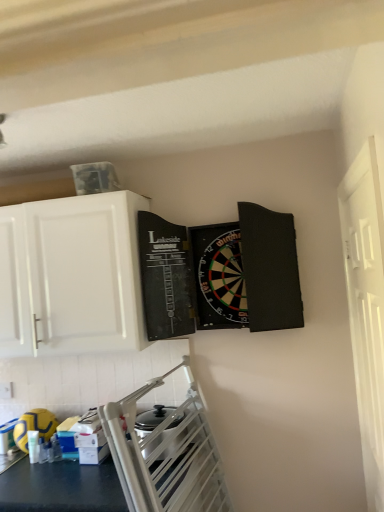
Question: Does yellow rubber ball at lower left appear on the left side of white wooden door at right?

Choices:
 (A) no
 (B) yes

Answer: (B)

Question: Can you confirm if yellow rubber ball at lower left is smaller than white wooden door at right?

Choices:
 (A) no
 (B) yes

Answer: (B)

Question: Are yellow rubber ball at lower left and white wooden door at right making contact?

Choices:
 (A) yes
 (B) no

Answer: (B)

Question: Is yellow rubber ball at lower left surrounding white wooden door at right?

Choices:
 (A) no
 (B) yes

Answer: (A)

Question: Can you confirm if yellow rubber ball at lower left is thinner than white wooden door at right?

Choices:
 (A) yes
 (B) no

Answer: (B)

Question: From a real-world perspective, does yellow rubber ball at lower left stand above white wooden door at right?

Choices:
 (A) no
 (B) yes

Answer: (A)

Question: From the image's perspective, does white glossy cabinet at upper left appear lower than white wooden door at right?

Choices:
 (A) no
 (B) yes

Answer: (A)

Question: Are white glossy cabinet at upper left and white wooden door at right far apart?

Choices:
 (A) no
 (B) yes

Answer: (B)

Question: Does white glossy cabinet at upper left have a smaller size compared to white wooden door at right?

Choices:
 (A) yes
 (B) no

Answer: (B)

Question: From the image's perspective, is white glossy cabinet at upper left above white wooden door at right?

Choices:
 (A) yes
 (B) no

Answer: (A)

Question: Is white glossy cabinet at upper left not inside white wooden door at right?

Choices:
 (A) no
 (B) yes

Answer: (B)

Question: Considering the relative sizes of white glossy cabinet at upper left and white wooden door at right in the image provided, is white glossy cabinet at upper left wider than white wooden door at right?

Choices:
 (A) yes
 (B) no

Answer: (A)

Question: Can you confirm if white wooden door at right is thinner than yellow rubber ball at lower left?

Choices:
 (A) yes
 (B) no

Answer: (A)